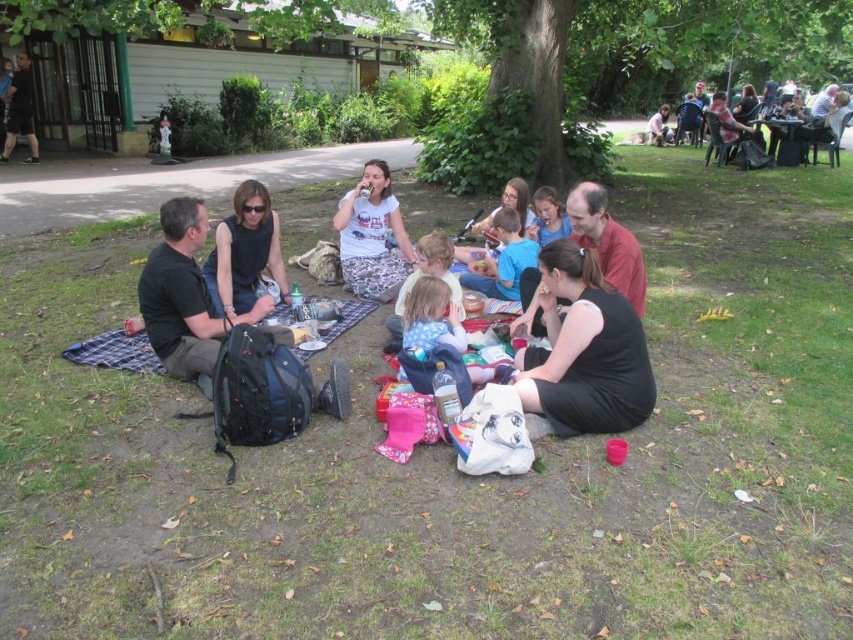
Is matte black backpack at lower left thinner than white cotton t-shirt at center?

No.

Is matte black backpack at lower left taller than white cotton t-shirt at center?

Incorrect, matte black backpack at lower left's height is not larger of white cotton t-shirt at center's.

You are a GUI agent. You are given a task and a screenshot of the screen. Output one action in this format:
    pyautogui.click(x=<x>, y=<y>)
    Task: Click on the matte black backpack at lower left
    
    Given the screenshot: What is the action you would take?
    pyautogui.click(x=584, y=328)

Where is `matte black backpack at lower left`? matte black backpack at lower left is located at coordinates (584, 328).

Is matte black backpack at lower left in front of black sleeveless top at center?

Yes, matte black backpack at lower left is in front of black sleeveless top at center.

Is point (596, 410) positioned in front of point (260, 227)?

That is True.

Is point (640, 330) less distant than point (271, 221)?

Yes, point (640, 330) is closer to viewer.

Find the location of a particular element. Image resolution: width=853 pixels, height=640 pixels. matte black backpack at lower left is located at coordinates (584, 328).

Does black sleeveless top at center come behind matte black table at upper right?

That is False.

Does black sleeveless top at center appear on the right side of matte black table at upper right?

No, black sleeveless top at center is not to the right of matte black table at upper right.

I want to click on black sleeveless top at center, so click(x=245, y=253).